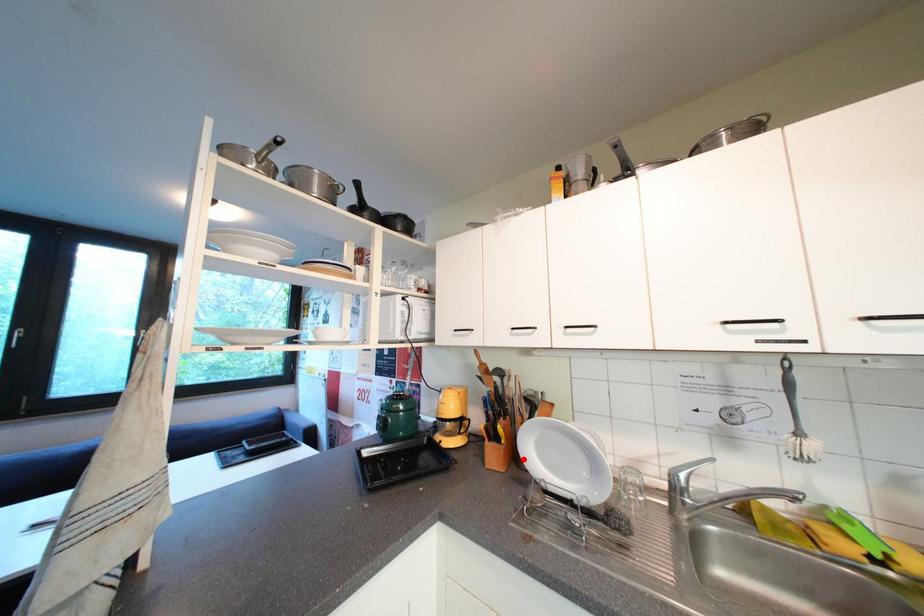
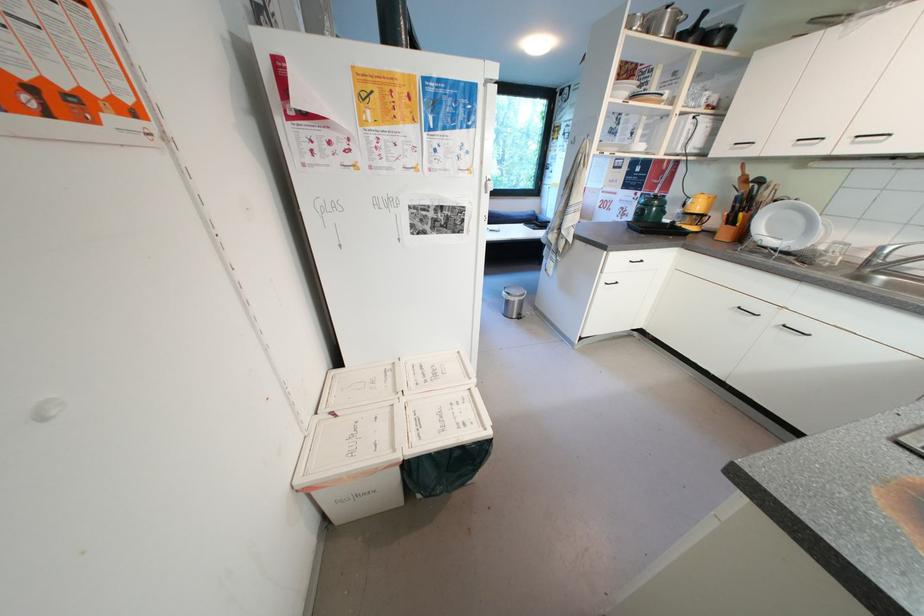
Question: I am providing you with two images of the same scene from different viewpoints. In image1, a red point is highlighted. Considering the same 3D point in image2, which of the following is correct?

Choices:
 (A) It is closer
 (B) It is farther

Answer: (A)